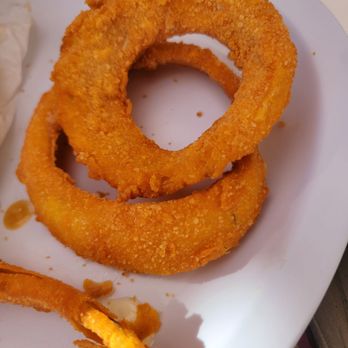
Identify the location of napkin. (18, 38).